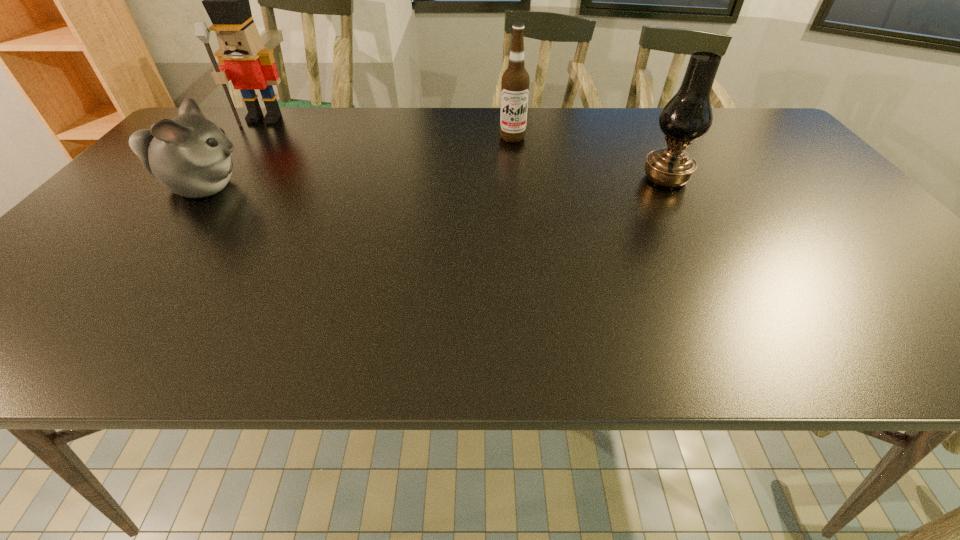
The width and height of the screenshot is (960, 540). What are the coordinates of `vacant space that satisfies the following two spatial constraints: 1. in front of the farthest object holding the staff; 2. on the left side of the oil lamp` in the screenshot? It's located at (219, 179).

Find the location of a particular element. free spot that satisfies the following two spatial constraints: 1. in front of the oil lamp holding the staff; 2. on the left side of the nutcracker is located at coordinates (219, 179).

Locate an element on the screen. vacant region that satisfies the following two spatial constraints: 1. on the label of the alcohol; 2. on the face of the shortest object is located at coordinates (518, 187).

Locate an element on the screen. The height and width of the screenshot is (540, 960). free space that satisfies the following two spatial constraints: 1. on the label of the oil lamp; 2. on the left side of the alcohol is located at coordinates (517, 179).

Where is `vacant position in the image that satisfies the following two spatial constraints: 1. in front of the oil lamp holding the staff; 2. on the left side of the nutcracker`? This screenshot has height=540, width=960. vacant position in the image that satisfies the following two spatial constraints: 1. in front of the oil lamp holding the staff; 2. on the left side of the nutcracker is located at coordinates 219,179.

Locate an element on the screen. The image size is (960, 540). vacant region that satisfies the following two spatial constraints: 1. in front of the nutcracker holding the staff; 2. on the face of the shortest object is located at coordinates (212, 187).

Locate an element on the screen. This screenshot has width=960, height=540. vacant space that satisfies the following two spatial constraints: 1. in front of the nutcracker holding the staff; 2. on the face of the shortest object is located at coordinates (212, 187).

I want to click on vacant space that satisfies the following two spatial constraints: 1. on the label of the oil lamp; 2. on the right side of the third nearest object, so click(517, 179).

In order to click on free space that satisfies the following two spatial constraints: 1. in front of the farthest object holding the staff; 2. on the face of the hamster in this screenshot , I will do `click(212, 187)`.